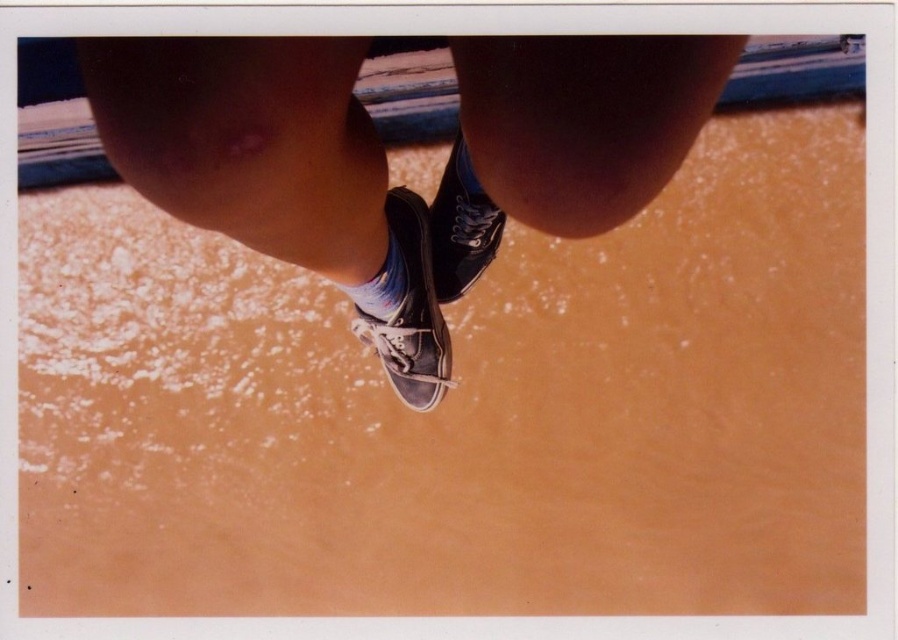
Question: Which point appears farthest from the camera in this image?

Choices:
 (A) (465, 186)
 (B) (436, 344)

Answer: (B)

Question: Can you confirm if matte black sneaker at center is smaller than multicolored fabric sock at center?

Choices:
 (A) yes
 (B) no

Answer: (B)

Question: Which object appears farthest from the camera in this image?

Choices:
 (A) multicolored fabric sock at center
 (B) canvas sneakers at center
 (C) matte black sneaker at center

Answer: (C)

Question: Which point appears farthest from the camera in this image?

Choices:
 (A) (366, 282)
 (B) (445, 248)
 (C) (377, 276)

Answer: (B)

Question: Does canvas sneakers at center appear on the left side of matte black sneaker at center?

Choices:
 (A) yes
 (B) no

Answer: (A)

Question: Is matte black sneaker at center positioned in front of multicolored fabric sock at center?

Choices:
 (A) yes
 (B) no

Answer: (B)